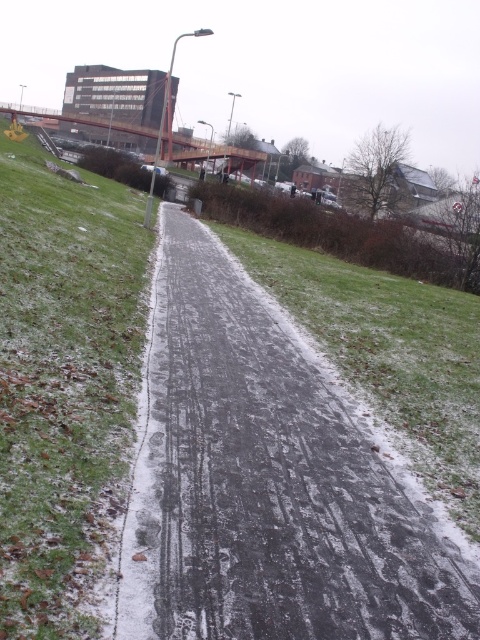
Does slick asphalt road at center have a lesser width compared to green grass at lower left?

Yes.

Identify the location of slick asphalt road at center. (268, 481).